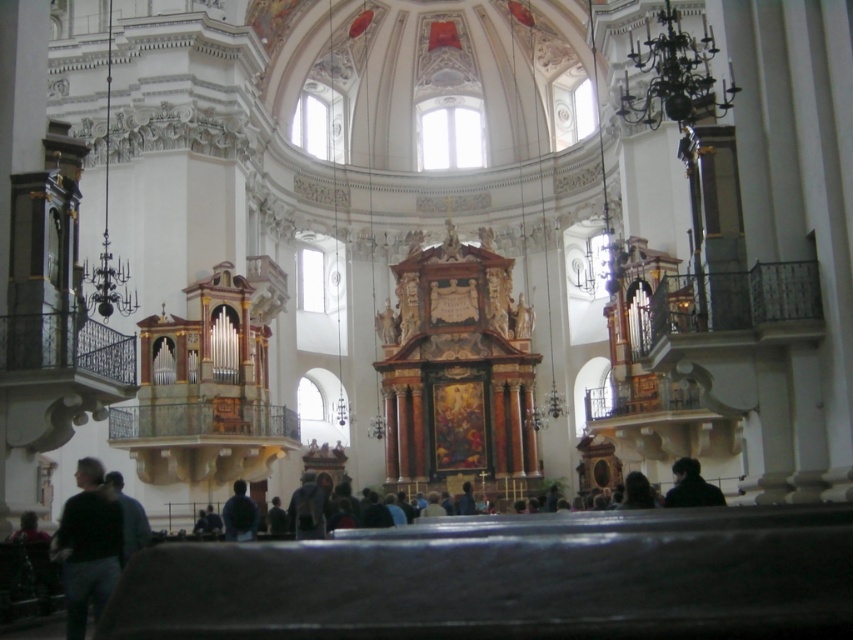
Between dark fabric jacket at lower right and dark matte clothing at lower center, which one appears on the right side from the viewer's perspective?

dark fabric jacket at lower right

Is point (689, 493) positioned in front of point (234, 518)?

Yes.

You are a GUI agent. You are given a task and a screenshot of the screen. Output one action in this format:
    pyautogui.click(x=<x>, y=<y>)
    Task: Click on the dark fabric jacket at lower right
    
    Given the screenshot: What is the action you would take?
    pyautogui.click(x=691, y=486)

Consider the image. Between dark blue shirt at lower center and dark matte clothing at lower center, which one is positioned higher?

dark blue shirt at lower center is higher up.

The width and height of the screenshot is (853, 640). In order to click on dark blue shirt at lower center in this screenshot , I will do `click(128, 516)`.

Locate an element on the screen. dark gray sweater at lower left is located at coordinates (88, 547).

Does dark gray sweater at lower left have a greater width compared to dark blue shirt at lower center?

No, dark gray sweater at lower left is not wider than dark blue shirt at lower center.

What do you see at coordinates (88, 547) in the screenshot? I see `dark gray sweater at lower left` at bounding box center [88, 547].

Where is `dark gray sweater at lower left`? dark gray sweater at lower left is located at coordinates (88, 547).